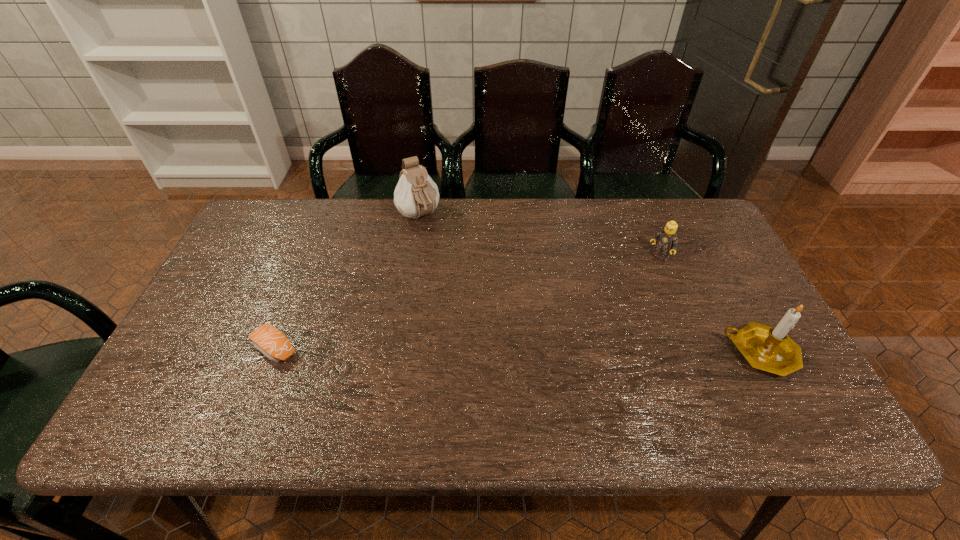
Find the location of a particular element. the shortest object is located at coordinates (269, 340).

At what (x,y) coordinates should I click in order to perform the action: click on sushi. Please return your answer as a coordinate pair (x, y). Image resolution: width=960 pixels, height=540 pixels. Looking at the image, I should click on (269, 340).

The image size is (960, 540). I want to click on the rightmost object, so click(767, 348).

The image size is (960, 540). Identify the location of the third object from left to right. (666, 239).

At what (x,y) coordinates should I click in order to perform the action: click on the second farthest object. Please return your answer as a coordinate pair (x, y). Looking at the image, I should click on (666, 239).

Find the location of `the farthest object`. the farthest object is located at coordinates (416, 194).

At what (x,y) coordinates should I click in order to perform the action: click on pouch. Please return your answer as a coordinate pair (x, y). Looking at the image, I should click on (416, 194).

At what (x,y) coordinates should I click in order to perform the action: click on free space located 0.120m on the back of the sushi. Please return your answer as a coordinate pair (x, y). This screenshot has width=960, height=540. Looking at the image, I should click on (296, 296).

The height and width of the screenshot is (540, 960). Identify the location of vacant space located with a handle on the candle holder. (583, 353).

Locate an element on the screen. Image resolution: width=960 pixels, height=540 pixels. vacant space located with a handle on the candle holder is located at coordinates (595, 353).